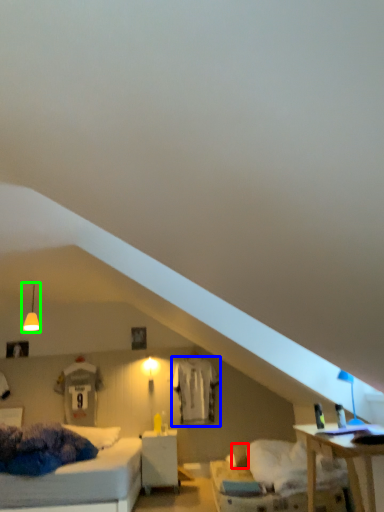
Question: Which object is the farthest from pillow (highlighted by a red box)? Choose among these: sheet (highlighted by a blue box) or fixture (highlighted by a green box).

Choices:
 (A) sheet
 (B) fixture

Answer: (B)